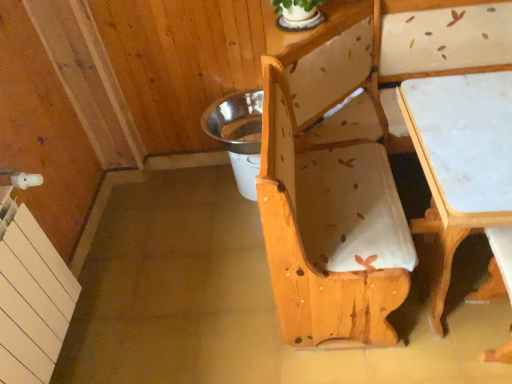
This screenshot has width=512, height=384. What are the coordinates of `free point above white marble table at lower right (from a real-world perspective)` in the screenshot? It's located at (471, 124).